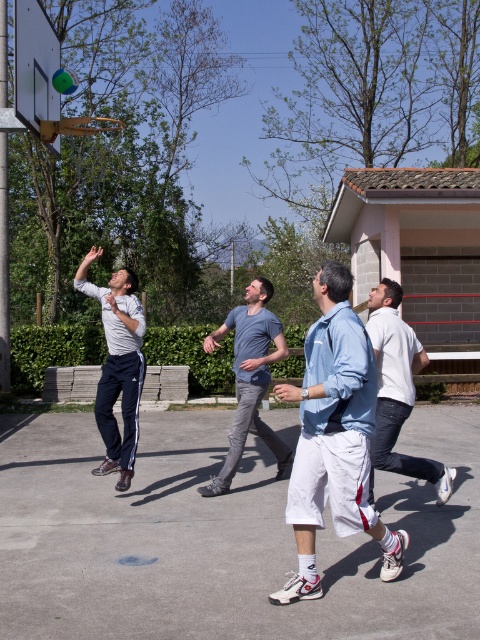
You are a photographer standing at the center of the basketball court. You want to take a photo that includes both the matte gray sweatshirt at left and the white cotton shirt at right. Which object should you focus on first to ensure both are in frame?

The matte gray sweatshirt at left is much taller than the white cotton shirt at right, so you should focus on the matte gray sweatshirt at left first to ensure both are in frame.

You are a photographer trying to capture the action of the basketball game. You notice the point at coordinate (x=118, y=365) on your camera grid. What object is located at this point?

The point at coordinate (x=118, y=365) corresponds to the matte gray sweatshirt at left.